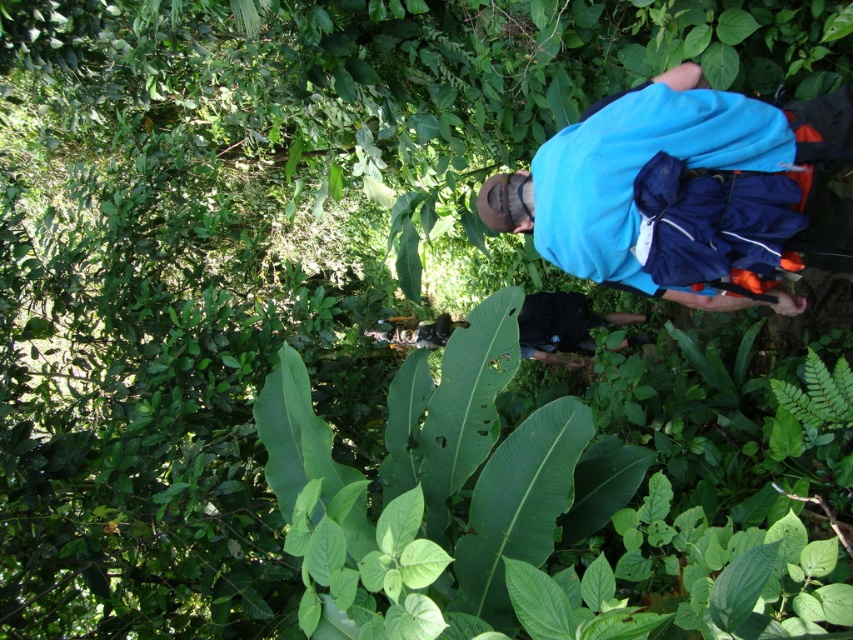
Question: Can you confirm if blue fabric backpack at center is positioned to the left of black fabric backpack at center?

Choices:
 (A) yes
 (B) no

Answer: (A)

Question: Which of the following is the farthest from the observer?

Choices:
 (A) (640, 106)
 (B) (392, 340)

Answer: (B)

Question: Among these objects, which one is nearest to the camera?

Choices:
 (A) blue fabric backpack at center
 (B) black fabric backpack at center

Answer: (A)

Question: Does blue fabric backpack at center appear on the left side of black fabric backpack at center?

Choices:
 (A) no
 (B) yes

Answer: (B)

Question: Does blue fabric backpack at center have a lesser width compared to black fabric backpack at center?

Choices:
 (A) yes
 (B) no

Answer: (B)

Question: Which of the following is the closest to the observer?

Choices:
 (A) black fabric backpack at center
 (B) blue fabric backpack at center

Answer: (B)